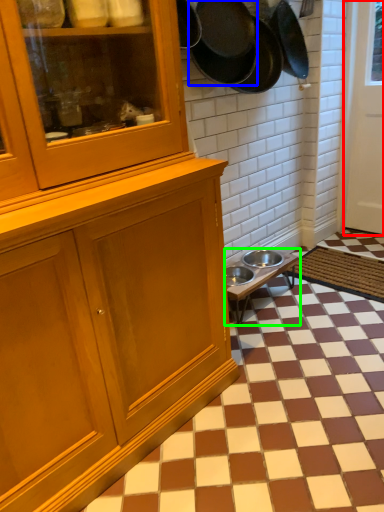
Question: Considering the real-world distances, which object is farthest from door (highlighted by a red box)? frying pan (highlighted by a blue box) or table (highlighted by a green box)?

Choices:
 (A) frying pan
 (B) table

Answer: (A)